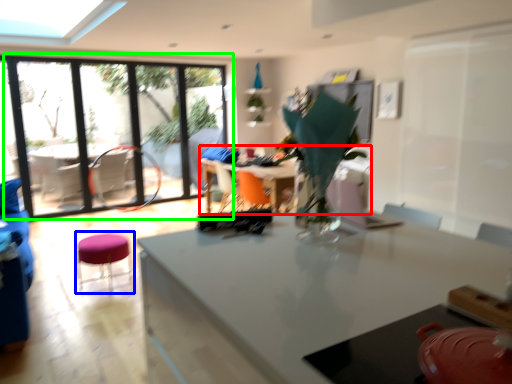
Question: Estimate the real-world distances between objects in this image. Which object is closer to table (highlighted by a red box), bar stool (highlighted by a blue box) or window (highlighted by a green box)?

Choices:
 (A) bar stool
 (B) window

Answer: (A)